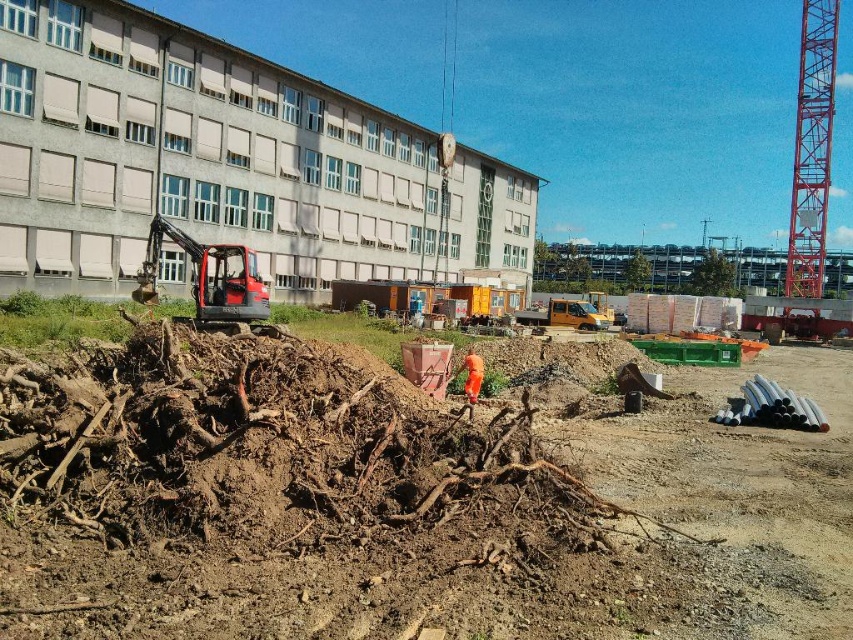
You are standing at the construction site and want to place a safety barrier between the two points labeled as point (225, 595) and point (467, 349). Which point should the barrier be closer to to ensure it is near the excavator?

Point (225, 595) is closer to the viewer than point (467, 349), so the barrier should be placed closer to point (225, 595) to ensure it is near the excavator.

You are a construction worker standing at the edge of the construction site. You need to move a heavy tool from the brown earthy dirt at center to the red metallic tower crane at right. Which object should you approach first to start moving the tool?

You should start at the brown earthy dirt at center because it is closer to you than the red metallic tower crane at right, so moving from the closer object first would be more efficient.

You are a safety inspector observing the construction site. You need to ensure that the brown earthy dirt at center does not block the matte black excavator at center from moving freely. Based on their heights, is there a risk that the dirt pile could obstruct the excavator?

The brown earthy dirt at center is shorter than the matte black excavator at center, so the dirt pile is not tall enough to obstruct the excavator.